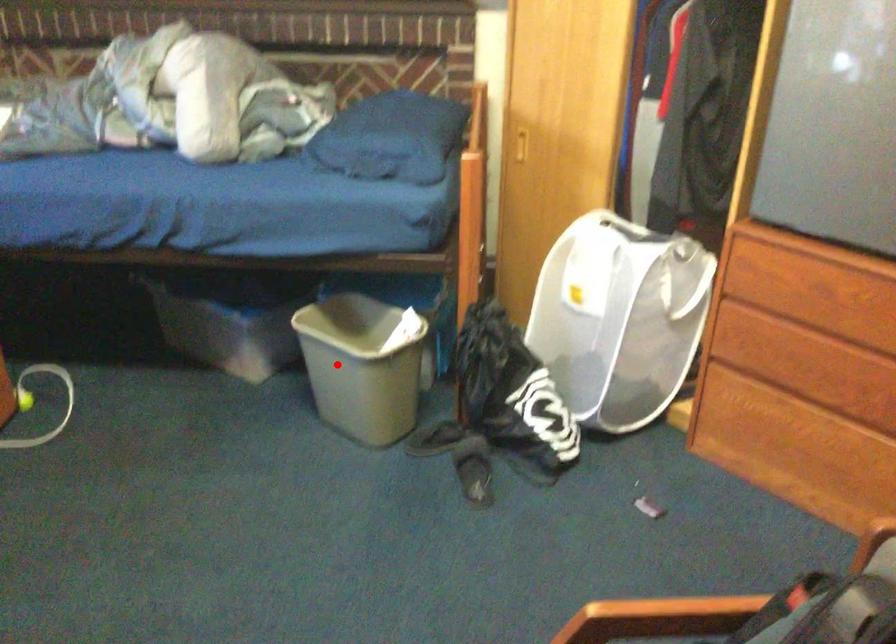
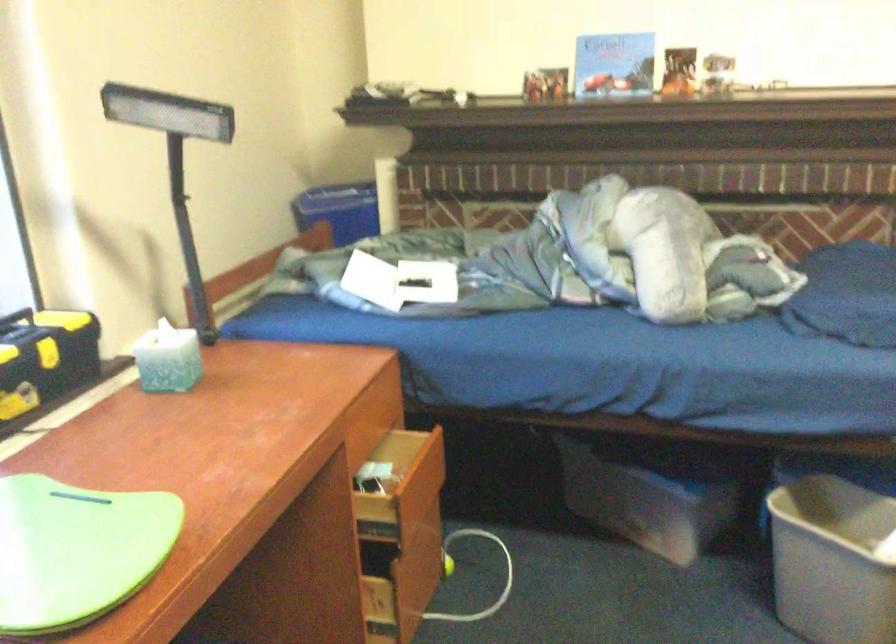
Where in the second image is the point corresponding to the highlighted location from the first image?

(832, 561)